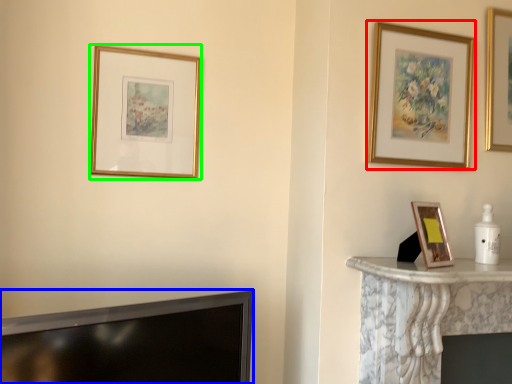
Question: Considering the real-world distances, which object is farthest from picture frame (highlighted by a red box)? television (highlighted by a blue box) or picture frame (highlighted by a green box)?

Choices:
 (A) television
 (B) picture frame

Answer: (A)